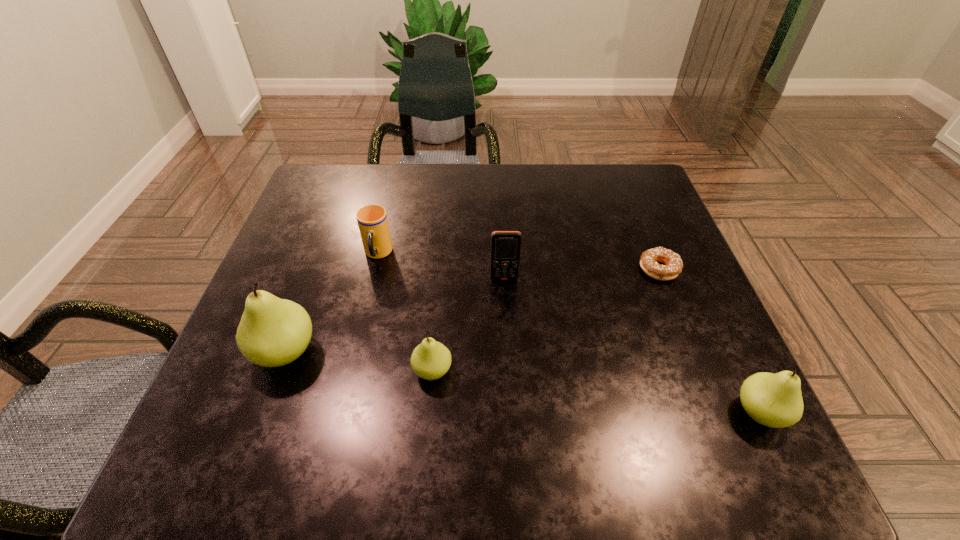
Where is `vacant space at the near edge of the desktop`? vacant space at the near edge of the desktop is located at coordinates (579, 416).

Locate an element on the screen. This screenshot has height=540, width=960. free location at the left edge is located at coordinates (337, 222).

What are the coordinates of `free space at the right edge of the desktop` in the screenshot? It's located at (698, 325).

In the image, there is a desktop. Identify the location of vacant space at the far left corner. The image size is (960, 540). (348, 212).

Locate an element on the screen. The image size is (960, 540). blank area at the near left corner is located at coordinates (251, 390).

Where is `vacant region at the far right corner of the desktop`? The image size is (960, 540). vacant region at the far right corner of the desktop is located at coordinates (592, 171).

Locate an element on the screen. This screenshot has height=540, width=960. vacant space in between the second pear from left to right and the second object from left to right is located at coordinates (405, 312).

You are a GUI agent. You are given a task and a screenshot of the screen. Output one action in this format:
    pyautogui.click(x=<x>, y=<y>)
    Task: Click on the free spot between the second pear from right to left and the fifth object from right to left
    Image resolution: width=960 pixels, height=540 pixels.
    Given the screenshot: What is the action you would take?
    pyautogui.click(x=405, y=312)

Where is `vacant area that lies between the cellular telephone and the cup`? This screenshot has width=960, height=540. vacant area that lies between the cellular telephone and the cup is located at coordinates 441,267.

Locate an element on the screen. vacant point located between the rightmost pear and the cup is located at coordinates (568, 333).